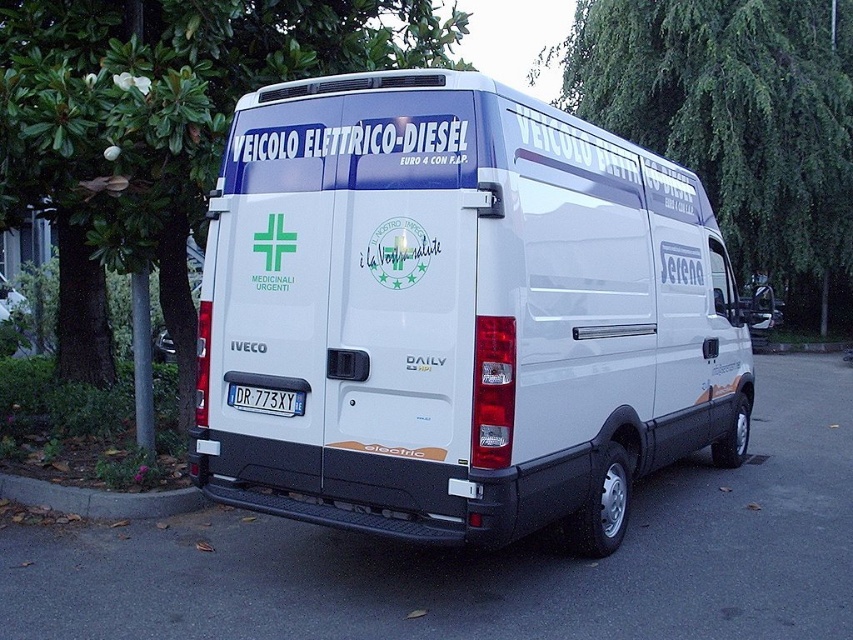
Measure the distance between concrete at lower left and camera.

The distance of concrete at lower left from camera is 17.56 feet.

Is concrete at lower left to the left of black plastic license plate at rear from the viewer's perspective?

Indeed, concrete at lower left is positioned on the left side of black plastic license plate at rear.

The height and width of the screenshot is (640, 853). Describe the element at coordinates (99, 499) in the screenshot. I see `concrete at lower left` at that location.

This screenshot has width=853, height=640. Identify the location of concrete at lower left. (99, 499).

Can you confirm if white glossy van at center is positioned above black plastic license plate at rear?

Yes.

Does white glossy van at center have a lesser height compared to black plastic license plate at rear?

Incorrect, white glossy van at center's height does not fall short of black plastic license plate at rear's.

Describe the element at coordinates (457, 314) in the screenshot. I see `white glossy van at center` at that location.

Identify the location of white glossy van at center. This screenshot has width=853, height=640. (457, 314).

Does white glossy van at center appear under concrete at lower left?

Incorrect, white glossy van at center is not positioned below concrete at lower left.

Can you confirm if white glossy van at center is bigger than concrete at lower left?

Yes.

Is point (663, 225) more distant than point (157, 499)?

Yes, it is behind point (157, 499).

At what (x,y) coordinates should I click in order to perform the action: click on white glossy van at center. Please return your answer as a coordinate pair (x, y). The height and width of the screenshot is (640, 853). Looking at the image, I should click on (457, 314).